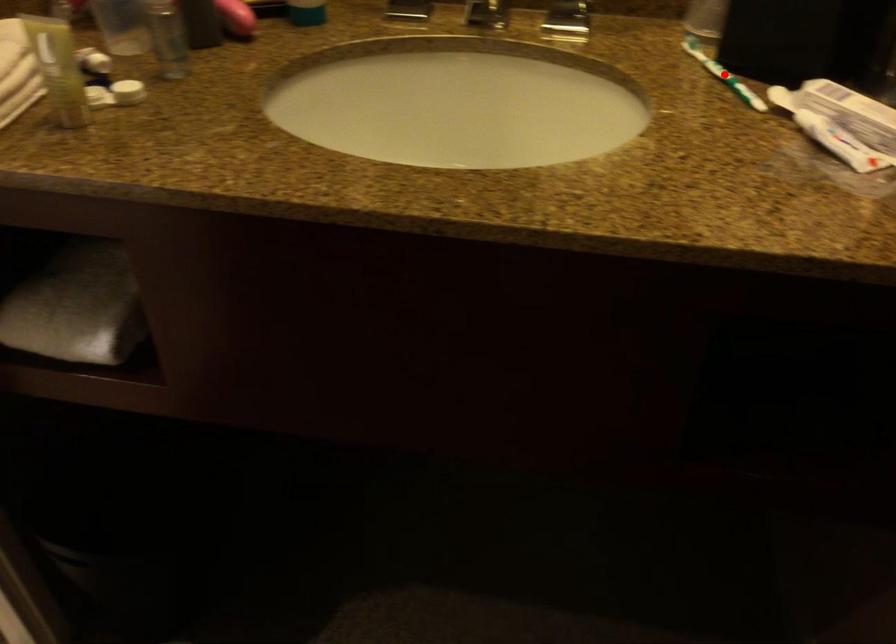
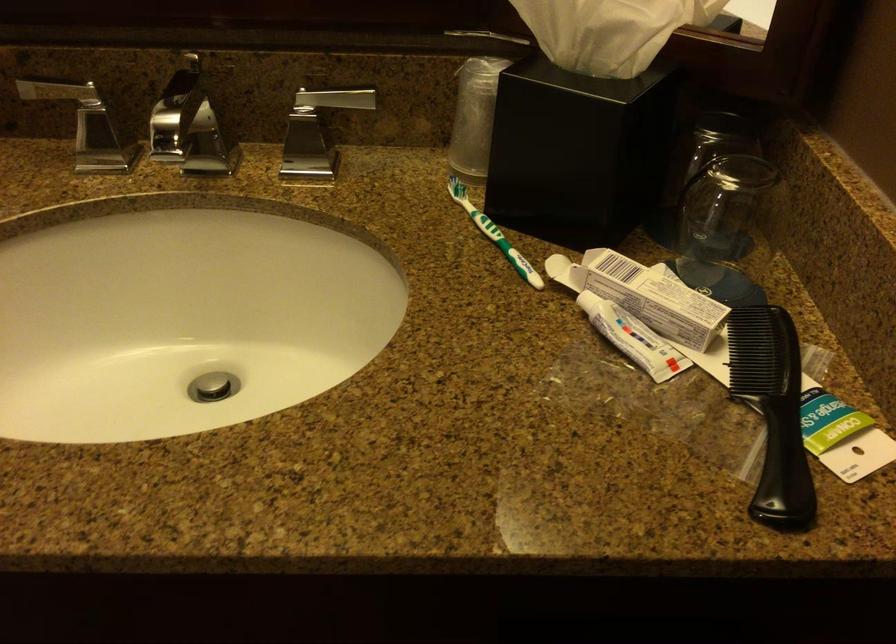
Question: I am providing you with two images of the same scene from different viewpoints. In image1, a red point is highlighted. Considering the same 3D point in image2, which of the following is correct?

Choices:
 (A) It is closer
 (B) It is farther

Answer: (A)